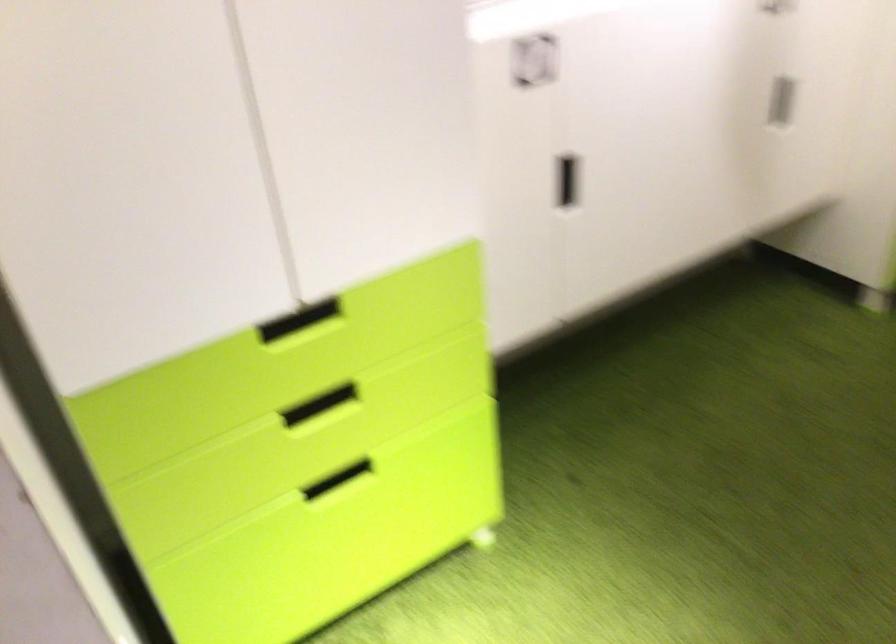
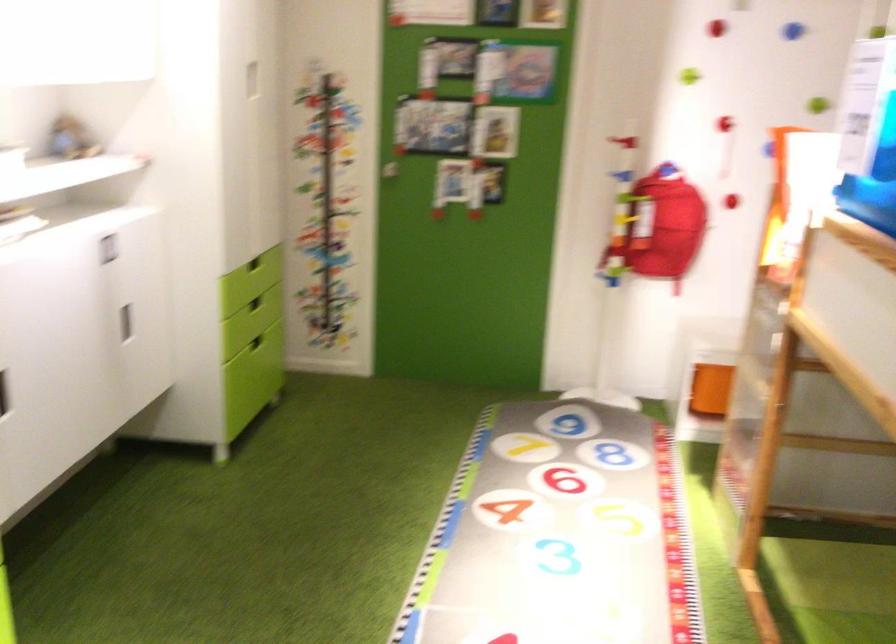
The point at (x=755, y=100) is marked in the first image. Where is the corresponding point in the second image?

(125, 323)